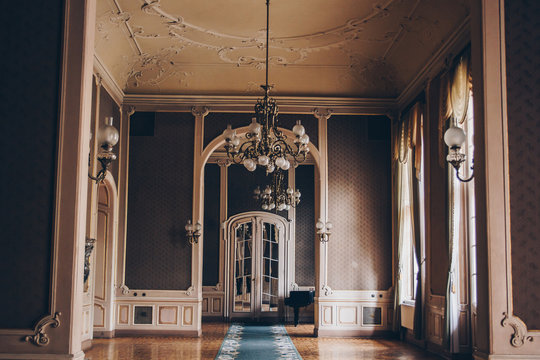
At what (x,y) coordinates should I click in order to perform the action: click on arched doorways. Please return your answer as a coordinate pair (x, y). This screenshot has width=540, height=360. Looking at the image, I should click on (114, 185), (213, 142).